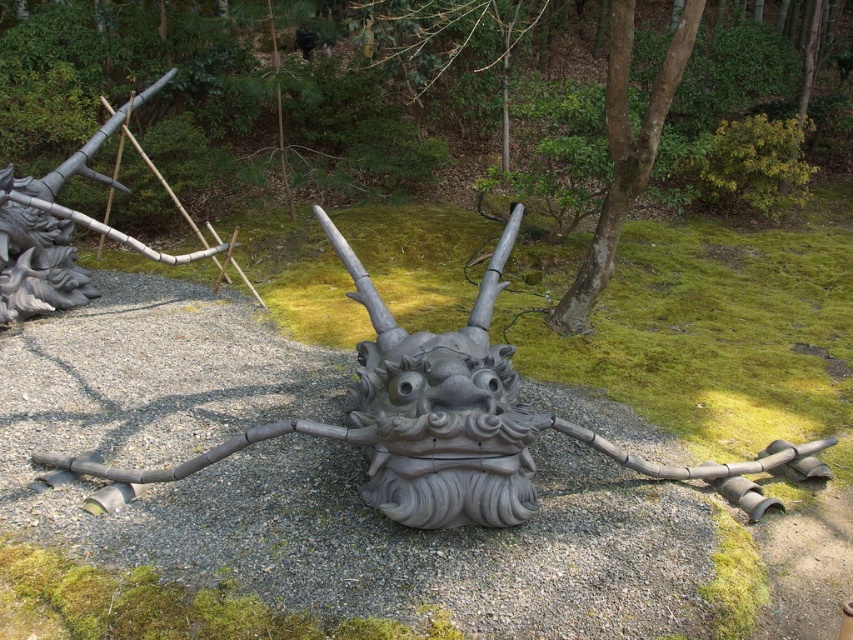
Who is positioned more to the right, brushed metal dragon head at left or brown smooth tree at center?

brown smooth tree at center is more to the right.

Find the location of a particular element. brushed metal dragon head at left is located at coordinates (57, 230).

At what (x,y) coordinates should I click in order to perform the action: click on brushed metal dragon head at left. Please return your answer as a coordinate pair (x, y). This screenshot has height=640, width=853. Looking at the image, I should click on (57, 230).